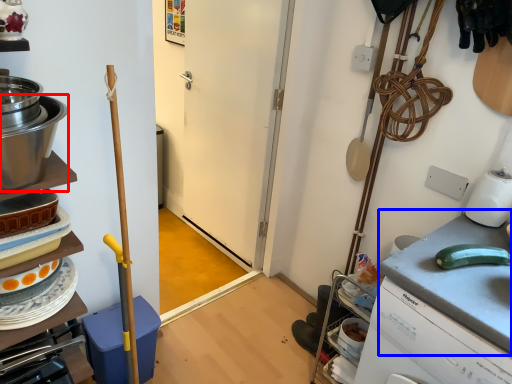
Question: Which object appears closest to the camera in this image, kitchen appliance (highlighted by a red box) or counter top (highlighted by a blue box)?

Choices:
 (A) kitchen appliance
 (B) counter top

Answer: (A)